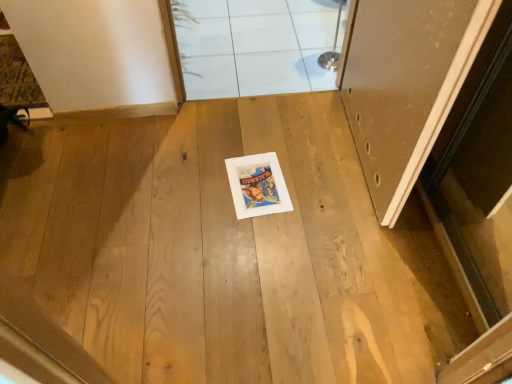
Question: Can you confirm if white tile at upper center is thinner than white glossy tile at upper center?

Choices:
 (A) no
 (B) yes

Answer: (A)

Question: From a real-world perspective, is white tile at upper center physically below white glossy tile at upper center?

Choices:
 (A) yes
 (B) no

Answer: (A)

Question: Can you confirm if white tile at upper center is positioned to the left of white glossy tile at upper center?

Choices:
 (A) no
 (B) yes

Answer: (B)

Question: Can you confirm if white tile at upper center is shorter than white glossy tile at upper center?

Choices:
 (A) yes
 (B) no

Answer: (A)

Question: Does white tile at upper center have a greater height compared to white glossy tile at upper center?

Choices:
 (A) yes
 (B) no

Answer: (B)

Question: Based on their sizes in the image, would you say white tile at upper center is bigger or smaller than white glossy tile at upper center?

Choices:
 (A) small
 (B) big

Answer: (B)

Question: From a real-world perspective, relative to white glossy tile at upper center, is white tile at upper center vertically above or below?

Choices:
 (A) below
 (B) above

Answer: (A)

Question: Considering the positions of white tile at upper center and white glossy tile at upper center in the image, is white tile at upper center taller or shorter than white glossy tile at upper center?

Choices:
 (A) short
 (B) tall

Answer: (A)

Question: Is white tile at upper center spatially inside white glossy tile at upper center, or outside of it?

Choices:
 (A) outside
 (B) inside

Answer: (A)

Question: In terms of height, does white glossy tile at upper center look taller or shorter compared to matte white door at right?

Choices:
 (A) tall
 (B) short

Answer: (B)

Question: In the image, is white glossy tile at upper center on the left side or the right side of matte white door at right?

Choices:
 (A) right
 (B) left

Answer: (B)

Question: Considering the positions of point (340, 29) and point (435, 61), is point (340, 29) closer or farther from the camera than point (435, 61)?

Choices:
 (A) closer
 (B) farther

Answer: (B)

Question: From a real-world perspective, is white glossy tile at upper center positioned above or below matte white door at right?

Choices:
 (A) below
 (B) above

Answer: (A)

Question: Is white tile at upper center bigger or smaller than matte white door at right?

Choices:
 (A) big
 (B) small

Answer: (A)

Question: Considering the positions of white tile at upper center and matte white door at right in the image, is white tile at upper center taller or shorter than matte white door at right?

Choices:
 (A) short
 (B) tall

Answer: (A)